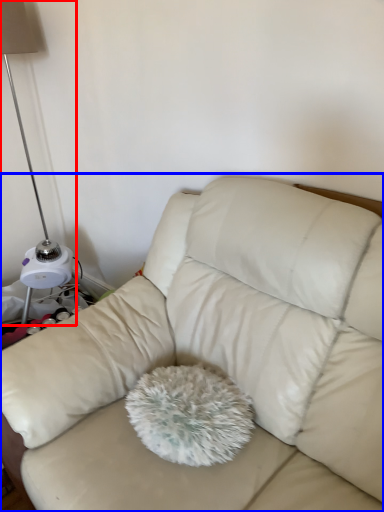
Question: Which of the following is the closest to the observer, lamp (highlighted by a red box) or studio couch (highlighted by a blue box)?

Choices:
 (A) lamp
 (B) studio couch

Answer: (B)